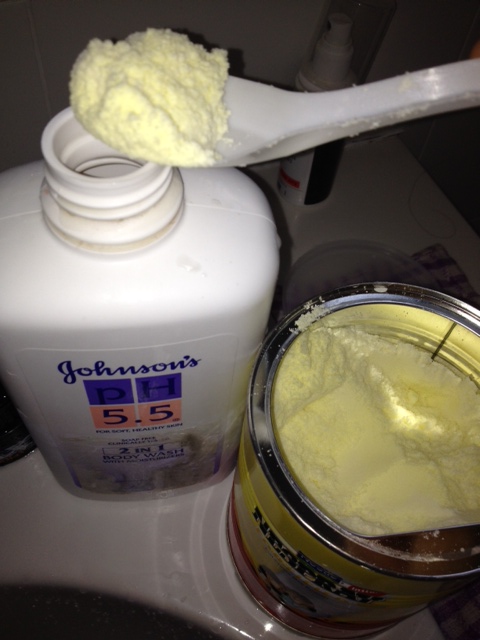
In order to click on white shelf in this screenshot , I will do `click(155, 563)`.